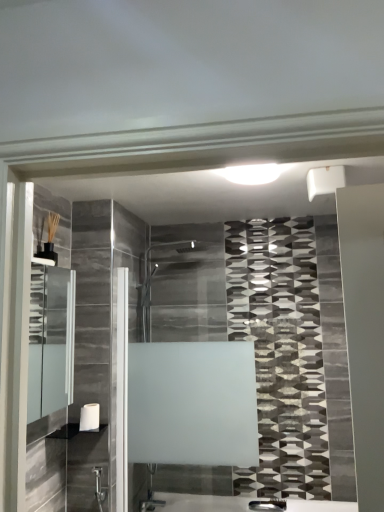
Question: In terms of size, does white glossy shelf at lower left appear bigger or smaller than clear glass medicine cabinet at left?

Choices:
 (A) big
 (B) small

Answer: (B)

Question: Is white glossy shelf at lower left in front of or behind clear glass medicine cabinet at left in the image?

Choices:
 (A) behind
 (B) front

Answer: (A)

Question: Which object is the farthest from the white matte towel bar at lower left?

Choices:
 (A) clear glass medicine cabinet at left
 (B) white glossy shelf at lower left

Answer: (A)

Question: Which object is the farthest from the clear glass medicine cabinet at left?

Choices:
 (A) white glossy shelf at lower left
 (B) white matte towel bar at lower left

Answer: (A)